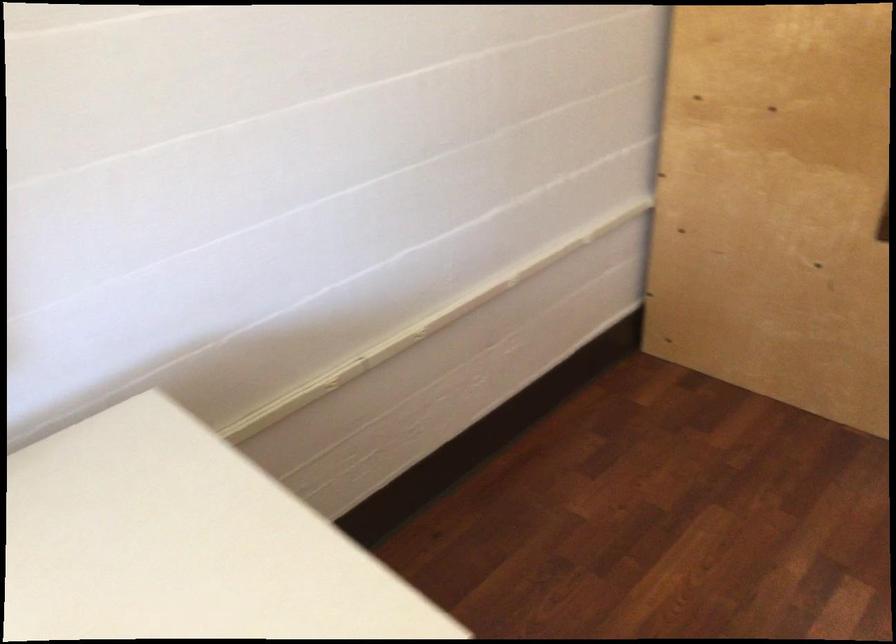
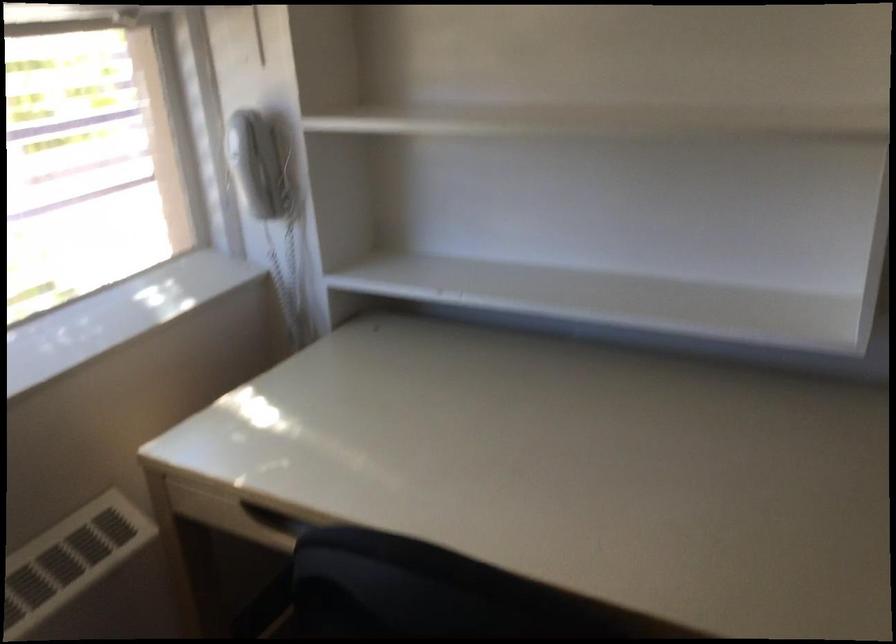
Based on the continuous images, in which direction is the camera rotating?

The camera's rotation is toward left-down.